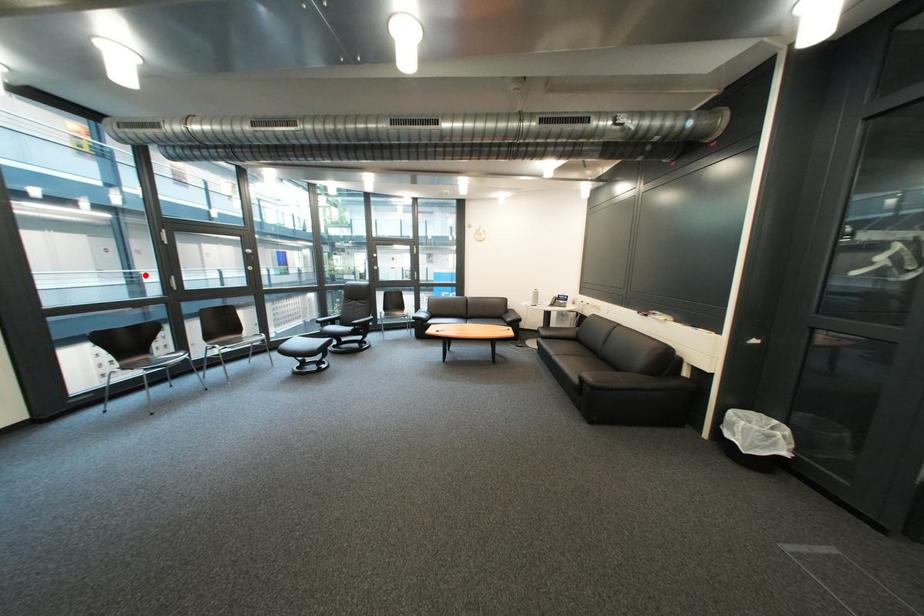
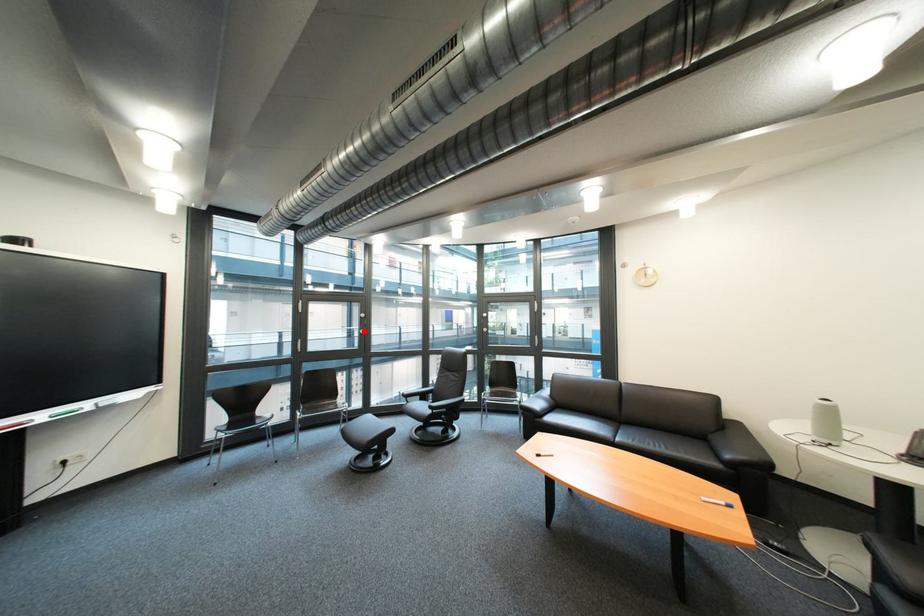
I am providing you with two images of the same scene from different viewpoints. A red point is marked on the first image and another point is marked on the second image. Does the point marked in image1 correspond to the same location as the one in image2?

Yes